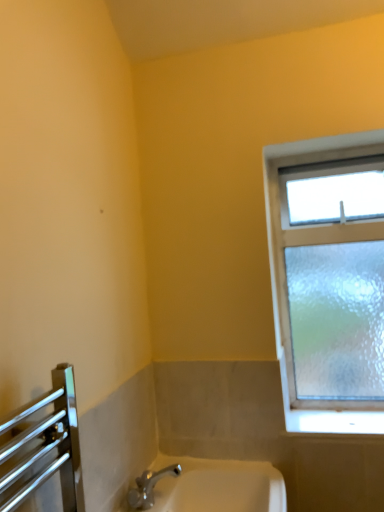
Image resolution: width=384 pixels, height=512 pixels. What are the coordinates of `frosted glass window at upper right` in the screenshot? It's located at (328, 280).

This screenshot has height=512, width=384. What do you see at coordinates (328, 280) in the screenshot?
I see `frosted glass window at upper right` at bounding box center [328, 280].

Measure the distance between white ceramic sink at lower center and camera.

white ceramic sink at lower center and camera are 1.16 meters apart from each other.

Where is `white ceramic sink at lower center`? Image resolution: width=384 pixels, height=512 pixels. white ceramic sink at lower center is located at coordinates (217, 486).

The height and width of the screenshot is (512, 384). Describe the element at coordinates (217, 486) in the screenshot. I see `white ceramic sink at lower center` at that location.

Find the location of a particular element. This screenshot has width=384, height=512. frosted glass window at upper right is located at coordinates (328, 280).

From the picture: Considering the relative positions of white ceramic sink at lower center and frosted glass window at upper right in the image provided, is white ceramic sink at lower center to the left or to the right of frosted glass window at upper right?

In the image, white ceramic sink at lower center appears on the left side of frosted glass window at upper right.

Relative to frosted glass window at upper right, is white ceramic sink at lower center in front or behind?

Visually, white ceramic sink at lower center is located in front of frosted glass window at upper right.

Is point (152, 465) closer to camera compared to point (355, 338)?

That is True.

From the image's perspective, is white ceramic sink at lower center beneath frosted glass window at upper right?

Correct, white ceramic sink at lower center appears lower than frosted glass window at upper right in the image.

From a real-world perspective, between white ceramic sink at lower center and frosted glass window at upper right, who is vertically lower?

white ceramic sink at lower center is physically lower.

Does white ceramic sink at lower center have a lesser width compared to frosted glass window at upper right?

In fact, white ceramic sink at lower center might be wider than frosted glass window at upper right.

Between white ceramic sink at lower center and frosted glass window at upper right, which one has more height?

frosted glass window at upper right.

Between white ceramic sink at lower center and frosted glass window at upper right, which one has smaller size?

white ceramic sink at lower center is smaller.

Would you say white ceramic sink at lower center is inside or outside frosted glass window at upper right?

white ceramic sink at lower center lies outside frosted glass window at upper right.

Are white ceramic sink at lower center and frosted glass window at upper right making contact?

white ceramic sink at lower center and frosted glass window at upper right are clearly separated.

Could you tell me if white ceramic sink at lower center is turned towards frosted glass window at upper right?

No.

How different are the orientations of white ceramic sink at lower center and frosted glass window at upper right in degrees?

The angle between the facing direction of white ceramic sink at lower center and the facing direction of frosted glass window at upper right is 90.3 degrees.

What are the coordinates of `sink below the frosted glass window at upper right (from the image's perspective)` in the screenshot? It's located at (217, 486).

Is frosted glass window at upper right to the right of white ceramic sink at lower center from the viewer's perspective?

Indeed, frosted glass window at upper right is positioned on the right side of white ceramic sink at lower center.

Which object is closer to the camera, frosted glass window at upper right or white ceramic sink at lower center?

white ceramic sink at lower center is more forward.

Consider the image. Which point is more distant from viewer, (x=333, y=263) or (x=208, y=483)?

Point (x=333, y=263)

From the image's perspective, is frosted glass window at upper right located beneath white ceramic sink at lower center?

No, from the image's perspective, frosted glass window at upper right is not beneath white ceramic sink at lower center.

From a real-world perspective, who is located lower, frosted glass window at upper right or white ceramic sink at lower center?

white ceramic sink at lower center, from a real-world perspective.

Between frosted glass window at upper right and white ceramic sink at lower center, which one has smaller width?

Thinner between the two is frosted glass window at upper right.

From their relative heights in the image, would you say frosted glass window at upper right is taller or shorter than white ceramic sink at lower center?

Clearly, frosted glass window at upper right is taller compared to white ceramic sink at lower center.

Who is bigger, frosted glass window at upper right or white ceramic sink at lower center?

frosted glass window at upper right.

Is frosted glass window at upper right spatially inside white ceramic sink at lower center, or outside of it?

frosted glass window at upper right exists outside the volume of white ceramic sink at lower center.

Is frosted glass window at upper right with white ceramic sink at lower center?

No, frosted glass window at upper right is not next to white ceramic sink at lower center.

Does frosted glass window at upper right turn towards white ceramic sink at lower center?

No, frosted glass window at upper right is not facing towards white ceramic sink at lower center.

How different are the orientations of frosted glass window at upper right and white ceramic sink at lower center in degrees?

The angular difference between frosted glass window at upper right and white ceramic sink at lower center is 90.3 degrees.

Locate an element on the screen. The height and width of the screenshot is (512, 384). window above the white ceramic sink at lower center (from a real-world perspective) is located at coordinates (328, 280).

Locate an element on the screen. sink below the frosted glass window at upper right (from a real-world perspective) is located at coordinates (217, 486).

Identify the location of window located behind the white ceramic sink at lower center. (328, 280).